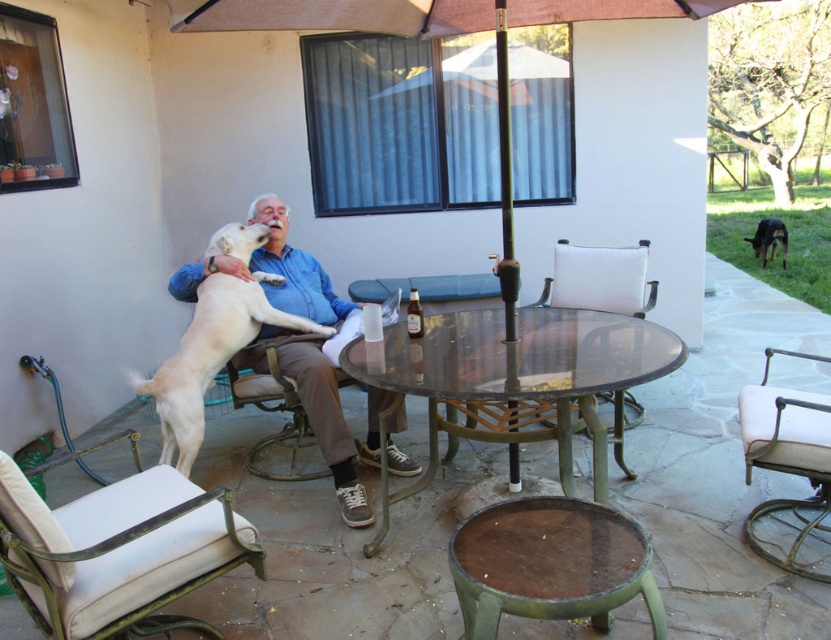
Is point (225, 276) in front of point (775, 221)?

That is True.

Is light brown fur at upper left smaller than black glossy dog at right?

Incorrect, light brown fur at upper left is not smaller in size than black glossy dog at right.

Locate an element on the screen. This screenshot has width=831, height=640. light brown fur at upper left is located at coordinates (209, 356).

Locate an element on the screen. light brown fur at upper left is located at coordinates (209, 356).

Does point (519, 230) come closer to viewer compared to point (278, 244)?

That is False.

Is orange fabric umbrella at center positioned behind light blue shirt at center?

Yes, it is behind light blue shirt at center.

Does point (686, 74) come behind point (370, 458)?

That is True.

The image size is (831, 640). In order to click on orange fabric umbrella at center in this screenshot , I will do tap(627, 138).

Between transparent glass table at center and white fabric chair at center, which one appears on the right side from the viewer's perspective?

white fabric chair at center is more to the right.

Between transparent glass table at center and white fabric chair at center, which one is positioned lower?

Positioned lower is white fabric chair at center.

Between point (652, 332) and point (549, 406), which one is positioned behind?

The point (652, 332) is behind.

In order to click on transparent glass table at center in this screenshot , I will do click(515, 381).